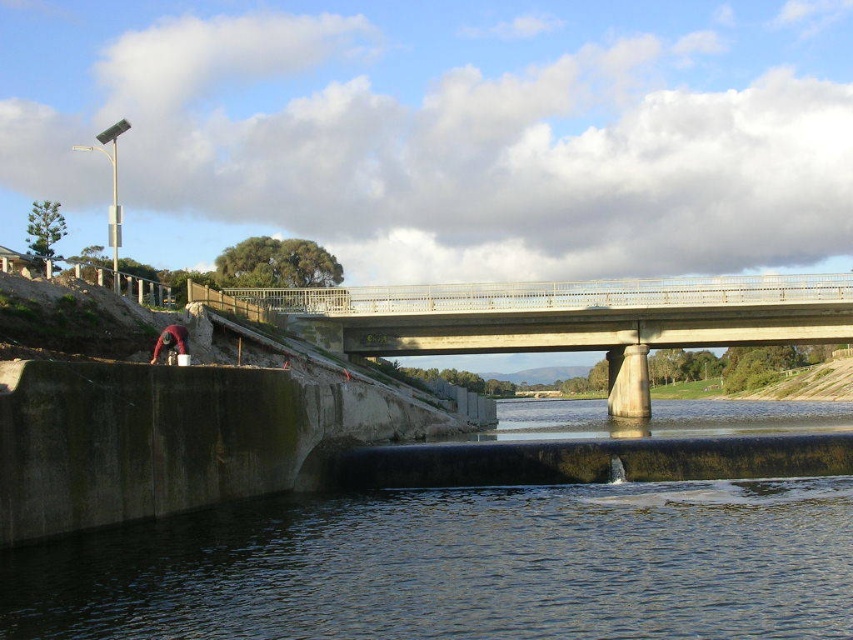
Question: Is dark blue water at lower center below concrete bridge at center?

Choices:
 (A) yes
 (B) no

Answer: (A)

Question: Is dark blue water at lower center positioned behind concrete bridge at center?

Choices:
 (A) yes
 (B) no

Answer: (B)

Question: Does dark blue water at lower center appear under concrete bridge at center?

Choices:
 (A) no
 (B) yes

Answer: (B)

Question: Which of the following is the closest to the observer?

Choices:
 (A) dark blue water at lower center
 (B) concrete bridge at center

Answer: (A)